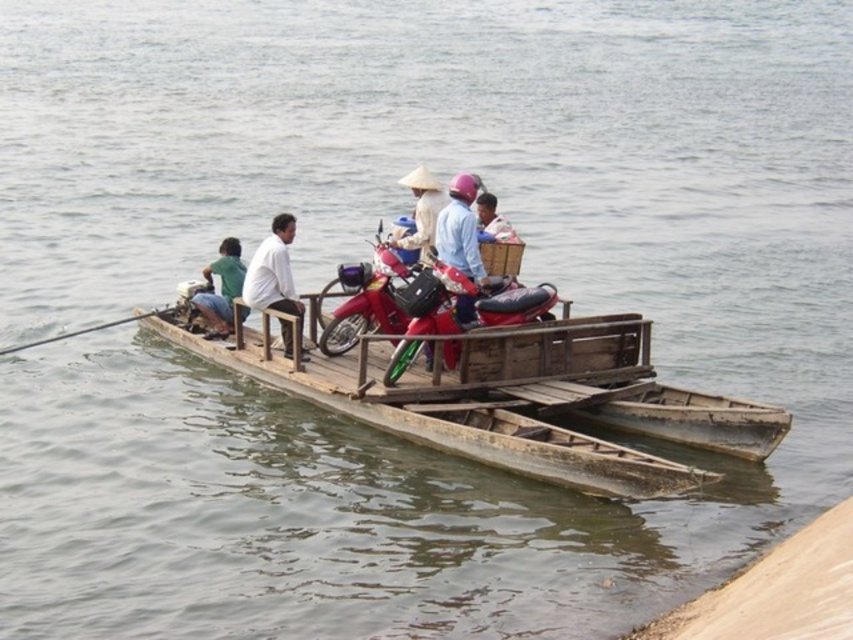
You are navigating a wooden boat at center on a river. To avoid a rock located at point 0.659, 0.530, should you steer left or right?

The wooden boat at center is located at point (x=451, y=420). To avoid the rock, you should steer away from that point, but the question mentions avoiding a rock at the boat current position, which is unclear. Please clarify the rock location relative to the boat.

From the picture: You are a passenger on the wooden boat at center. You want to move to the metallic red motorcycle at center to retrieve your bag. Can you directly walk to the motorcycle without stepping over any obstacles?

The wooden boat at center is closer to the viewer than metallic red motorcycle at center, so the motorcycle is further away. You can walk towards it but need to ensure there are no obstructions like passengers or secured items blocking your path.